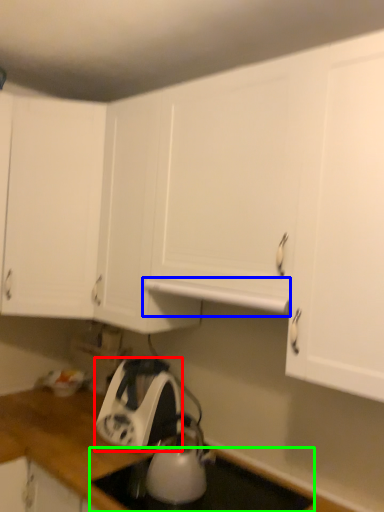
Question: Which object is the closest to the home appliance (highlighted by a red box)? Choose among these: exhaust hood (highlighted by a blue box) or gas stove (highlighted by a green box).

Choices:
 (A) exhaust hood
 (B) gas stove

Answer: (B)